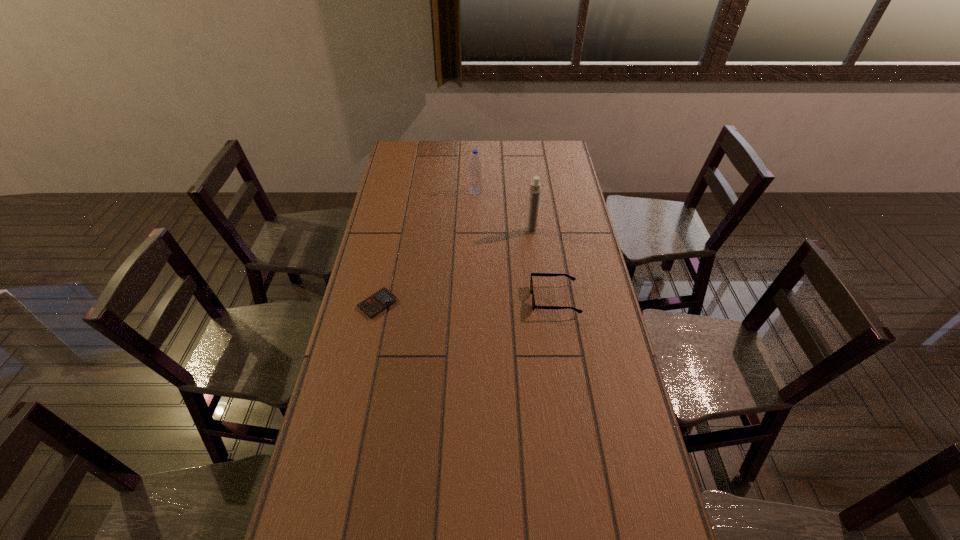
Where is `free space located on the arms of the third tallest object`? free space located on the arms of the third tallest object is located at coordinates (424, 299).

Find the location of `vacant space located on the arms of the third tallest object`. vacant space located on the arms of the third tallest object is located at coordinates (503, 299).

The height and width of the screenshot is (540, 960). Find the location of `free space located 0.260m on the front of the calculator`. free space located 0.260m on the front of the calculator is located at coordinates (359, 389).

This screenshot has width=960, height=540. Identify the location of object at the left edge. (382, 299).

Locate an element on the screen. object that is at the right edge is located at coordinates (532, 274).

Locate an element on the screen. This screenshot has height=540, width=960. free space at the far edge of the desktop is located at coordinates (508, 157).

The width and height of the screenshot is (960, 540). In the image, there is a desktop. What are the coordinates of `vacant space at the left edge` in the screenshot? It's located at (355, 403).

This screenshot has width=960, height=540. Identify the location of free region at the right edge of the desktop. (556, 244).

This screenshot has height=540, width=960. Identify the location of vacant region at the far left corner of the desktop. (420, 144).

Locate an element on the screen. free spot at the far right corner of the desktop is located at coordinates (540, 140).